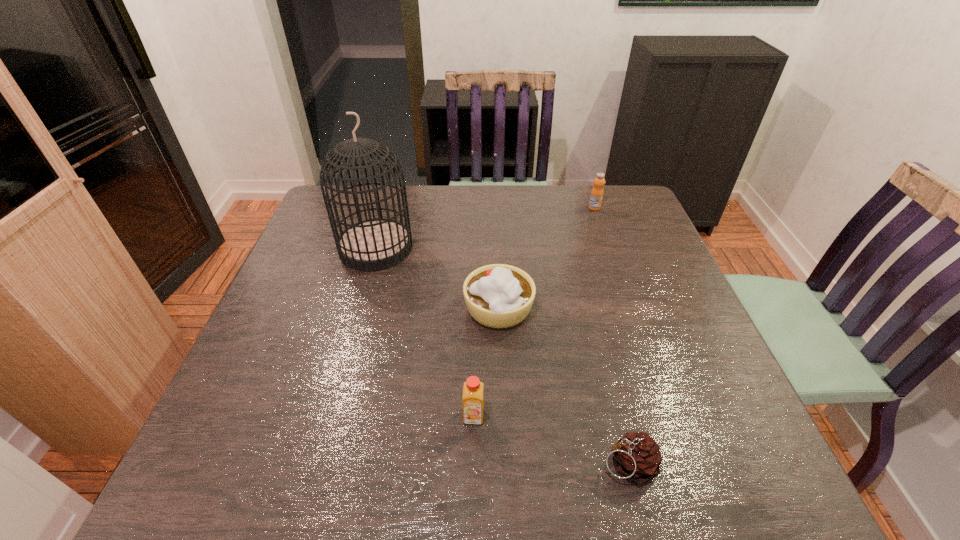
Locate an element on the screen. The image size is (960, 540). unoccupied area between the birdcage and the third nearest object is located at coordinates (438, 278).

The image size is (960, 540). Identify the location of empty space between the birdcage and the second object from right to left. (502, 356).

I want to click on empty location between the farthest object and the nearest object, so click(x=611, y=336).

What are the coordinates of `free area in between the birdcage and the left orange juice` in the screenshot? It's located at (425, 332).

Image resolution: width=960 pixels, height=540 pixels. I want to click on empty space that is in between the nearest object and the left orange juice, so click(551, 441).

Image resolution: width=960 pixels, height=540 pixels. What are the coordinates of `vacant space in between the rightmost object and the left orange juice` in the screenshot? It's located at (534, 312).

Where is `free area in between the tallest object and the nearer orange juice`? The image size is (960, 540). free area in between the tallest object and the nearer orange juice is located at coordinates (425, 332).

Identify the location of vacant space in between the tallest object and the left orange juice. (425, 332).

Locate which object is the second closest to the shortest object. Please provide its 2D coordinates. Your answer should be formatted as a tuple, i.e. [(x, y)], where the tuple contains the x and y coordinates of a point satisfying the conditions above.

[(498, 295)]

Find the location of a particular element. This screenshot has width=960, height=540. object that is the fourth nearest to the left orange juice is located at coordinates (596, 196).